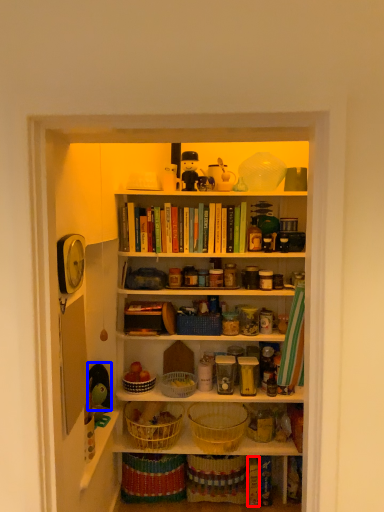
Question: Which object is closer to the camera taking this photo, book (highlighted by a red box) or toy (highlighted by a blue box)?

Choices:
 (A) book
 (B) toy

Answer: (B)